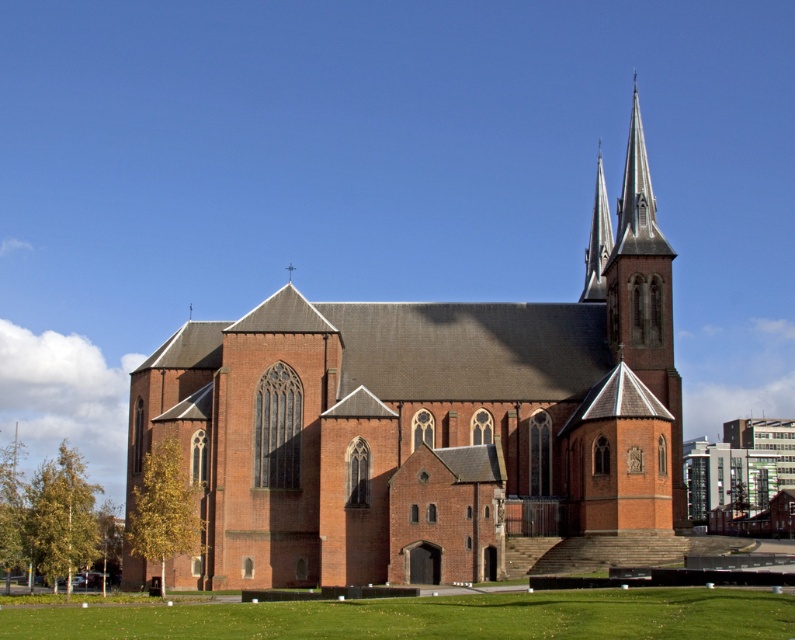
Question: Among these objects, which one is farthest from the camera?

Choices:
 (A) red brick church at center
 (B) smooth stone spire at upper right
 (C) red brick church steeple at upper right

Answer: (B)

Question: Among these objects, which one is farthest from the camera?

Choices:
 (A) red brick church steeple at upper right
 (B) red brick church at center

Answer: (A)

Question: Does red brick church at center appear on the right side of red brick church steeple at upper right?

Choices:
 (A) no
 (B) yes

Answer: (A)

Question: Which object is farther from the camera taking this photo?

Choices:
 (A) smooth stone spire at upper right
 (B) red brick church at center
 (C) red brick church steeple at upper right

Answer: (A)

Question: Is red brick church at center wider than red brick church steeple at upper right?

Choices:
 (A) no
 (B) yes

Answer: (B)

Question: Can you confirm if red brick church steeple at upper right is positioned above smooth stone spire at upper right?

Choices:
 (A) yes
 (B) no

Answer: (A)